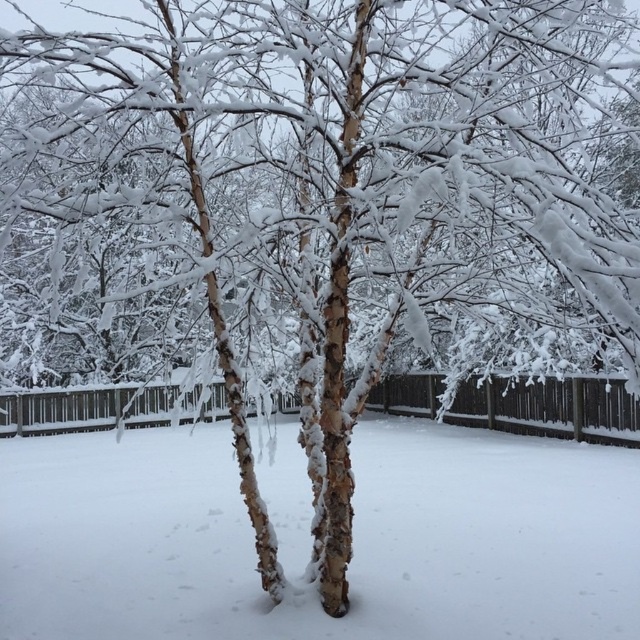
You are an artist sketching the winter scene. You need to decide which area to focus on first based on their sizes. Which object should you sketch first, the white textured snow at center or the brown wooden fence at center?

The brown wooden fence at center is larger than the white textured snow at center, so you should sketch the brown wooden fence at center first because it occupies more space in the scene.

Based on the photo, you are an artist planning to paint this winter scene. You want to ensure the white textured snow at center and brown wooden fence at center are proportionally accurate. Which object should you paint wider to maintain the correct proportions?

The brown wooden fence at center should be painted wider than the white textured snow at center because the description states that the white textured snow at center has a smaller width compared to the brown wooden fence at center.